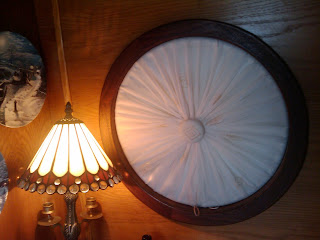
I want to click on painting/wall decor, so point(26,75).